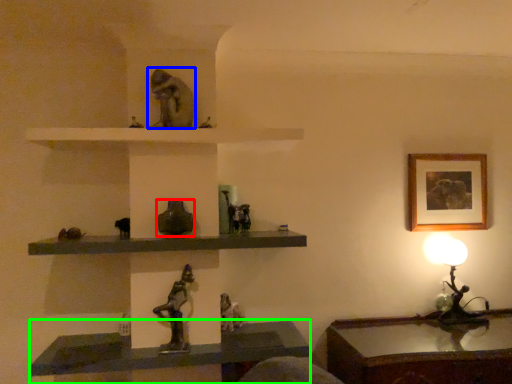
Question: Which object is positioned closest to glass vase (highlighted by a red box)? Select from animal (highlighted by a blue box) and vanity (highlighted by a green box).

Choices:
 (A) animal
 (B) vanity

Answer: (A)